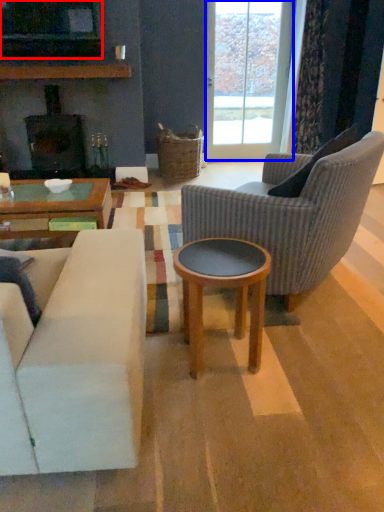
Question: Which object appears farthest to the camera in this image, television (highlighted by a red box) or glass door (highlighted by a blue box)?

Choices:
 (A) television
 (B) glass door

Answer: (B)